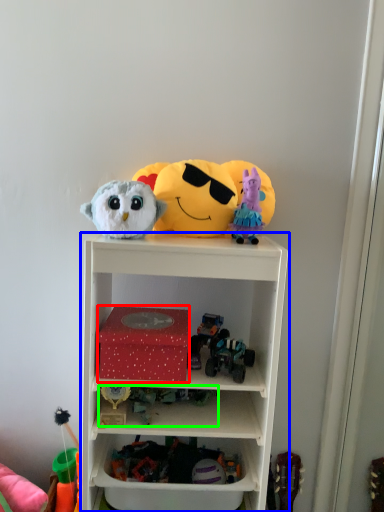
Question: Based on their relative distances, which object is nearer to box (highlighted by a red box)? Choose from shelf (highlighted by a blue box) and toy (highlighted by a green box).

Choices:
 (A) shelf
 (B) toy

Answer: (B)